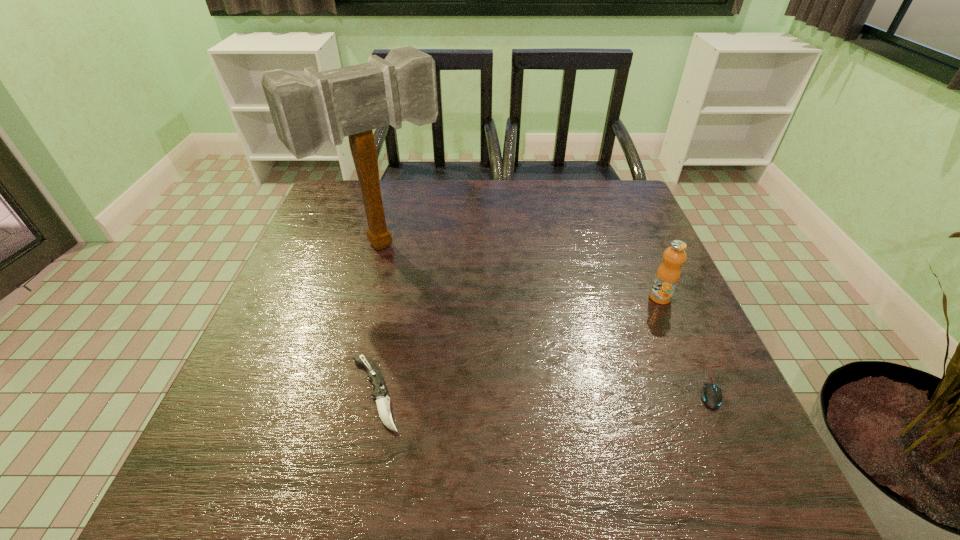
Find the location of a particular element. vacant space that satisfies the following two spatial constraints: 1. on the front side of the orange juice; 2. on the right side of the mallet is located at coordinates (369, 298).

You are a GUI agent. You are given a task and a screenshot of the screen. Output one action in this format:
    pyautogui.click(x=<x>, y=<y>)
    Task: Click on the free space that satisfies the following two spatial constraints: 1. on the front side of the pocketknife; 2. on the right side of the tallest object
    
    Given the screenshot: What is the action you would take?
    pyautogui.click(x=344, y=394)